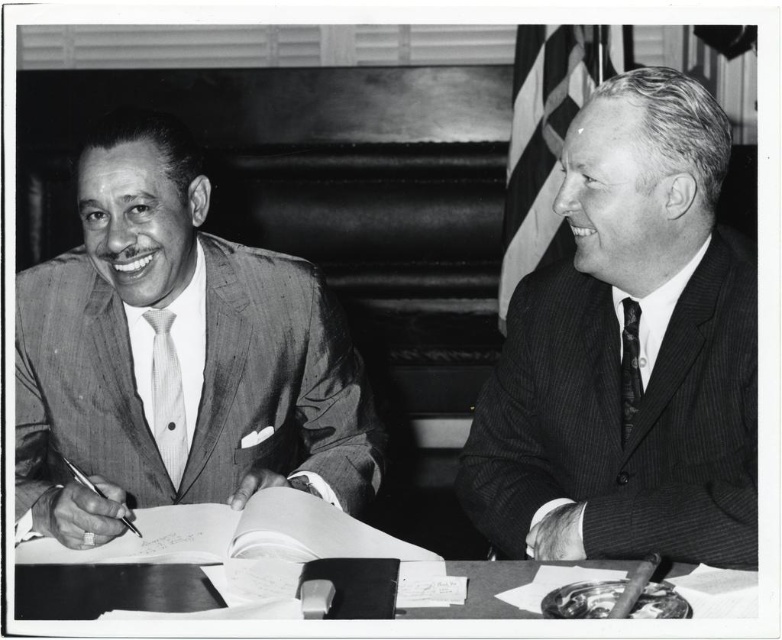
Who is positioned more to the right, smooth wooden table at center or pinstriped fabric tie at left?

From the viewer's perspective, smooth wooden table at center appears more on the right side.

Is point (497, 577) positioned before point (160, 342)?

Yes, it is in front of point (160, 342).

Where is `smooth wooden table at center`? smooth wooden table at center is located at coordinates (108, 589).

Is point (192, 448) positioned behind point (122, 592)?

Yes.

The image size is (782, 640). I want to click on striped suit at left, so click(174, 356).

Measure the distance between striped suit at left and camera.

They are 1.09 meters apart.

The image size is (782, 640). Identify the location of striped suit at left. (174, 356).

In the scene shown: Between pinstriped suit at right and pinstriped fabric tie at left, which one appears on the left side from the viewer's perspective?

Positioned to the left is pinstriped fabric tie at left.

Does pinstriped suit at right have a lesser height compared to pinstriped fabric tie at left?

In fact, pinstriped suit at right may be taller than pinstriped fabric tie at left.

At what (x,y) coordinates should I click in order to perform the action: click on pinstriped suit at right. Please return your answer as a coordinate pair (x, y). Image resolution: width=782 pixels, height=640 pixels. Looking at the image, I should click on (619, 349).